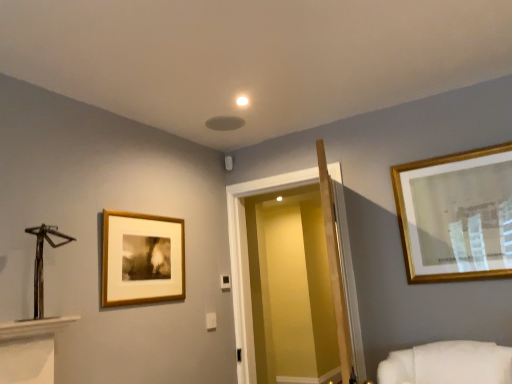
Question: From a real-world perspective, relative to transparent glass door at center, is wooden framed print at left vertically above or below?

Choices:
 (A) above
 (B) below

Answer: (A)

Question: Looking at the image, does wooden framed print at left seem bigger or smaller compared to transparent glass door at center?

Choices:
 (A) big
 (B) small

Answer: (B)

Question: In the image, is wooden framed print at left positioned in front of or behind transparent glass door at center?

Choices:
 (A) behind
 (B) front

Answer: (B)

Question: Choose the correct answer: Is transparent glass door at center inside wooden framed print at left or outside it?

Choices:
 (A) outside
 (B) inside

Answer: (A)

Question: Is transparent glass door at center in front of or behind wooden framed print at left in the image?

Choices:
 (A) behind
 (B) front

Answer: (A)

Question: Considering the positions of transparent glass door at center and wooden framed print at left in the image, is transparent glass door at center taller or shorter than wooden framed print at left?

Choices:
 (A) short
 (B) tall

Answer: (B)

Question: Looking at their shapes, would you say transparent glass door at center is wider or thinner than wooden framed print at left?

Choices:
 (A) thin
 (B) wide

Answer: (B)